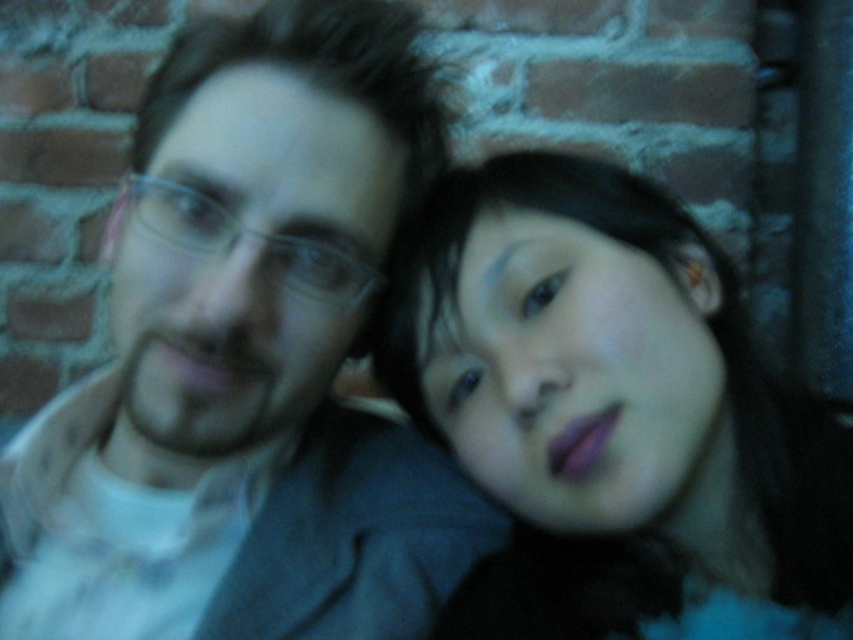
You are a photographer adjusting the focus of your camera. The camera has a focus point at coordinates 0.648, 0.719. Which object from the scene should you focus on to capture the matte black hair at center clearly?

The matte black hair at center is located at point [612,413], so you should focus on the matte black hair at center to capture it clearly.